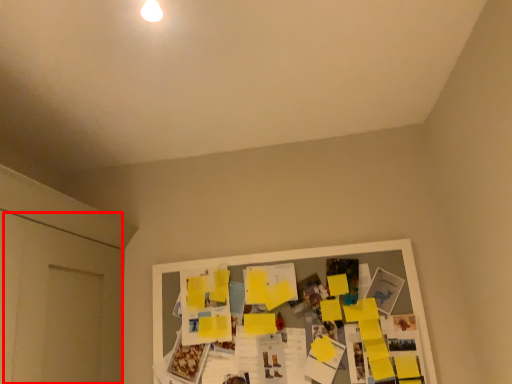
Question: From the image's perspective, where is door (annotated by the red box) located relative to bulletin board?

Choices:
 (A) above
 (B) below

Answer: (A)